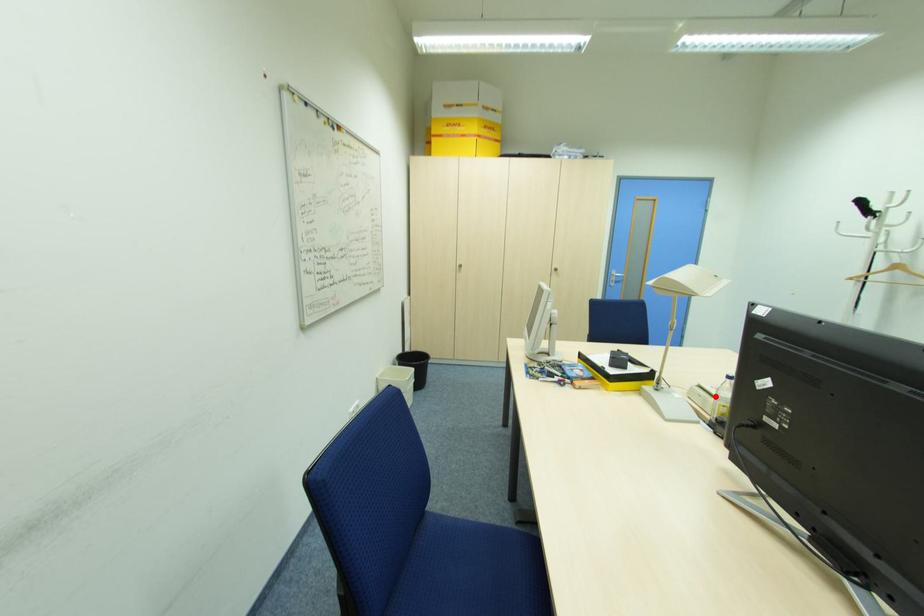
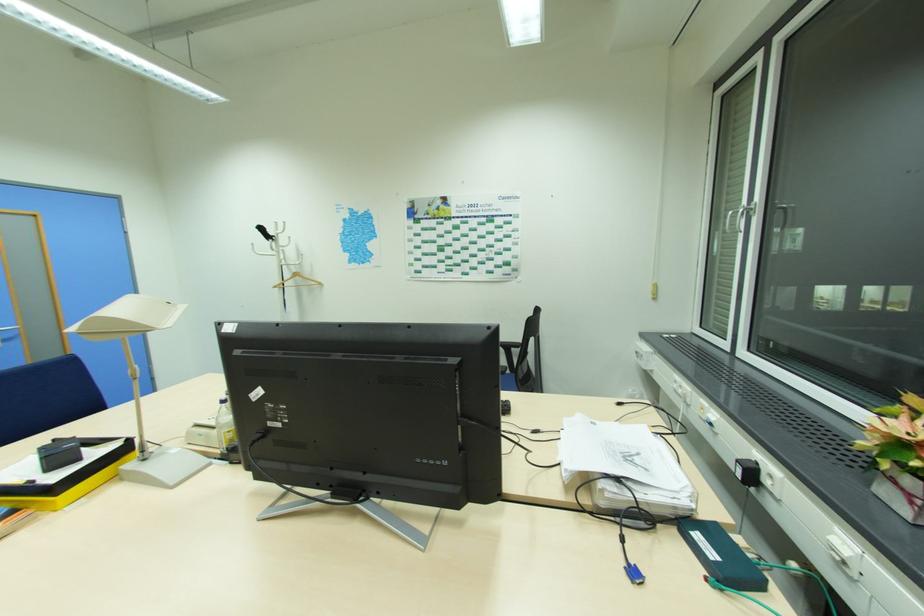
Find the pixel in the second image that matches the highlighted location in the first image.

(216, 428)